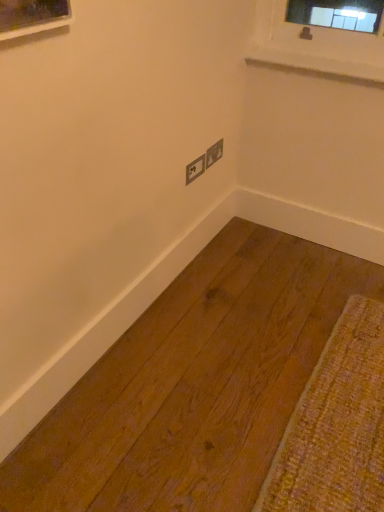
Question: From their relative heights in the image, would you say matte gray electrical outlet at center, the first electric outlet positioned from the right, is taller or shorter than white smooth window sill at upper right?

Choices:
 (A) short
 (B) tall

Answer: (B)

Question: Visually, is matte gray electrical outlet at center, acting as the second electric outlet starting from the left, positioned to the left or to the right of white smooth window sill at upper right?

Choices:
 (A) left
 (B) right

Answer: (A)

Question: Based on their relative distances, which object is nearer to the matte gray electric outlet at center, arranged as the second electric outlet when viewed from the right?

Choices:
 (A) white smooth window sill at upper right
 (B) matte gray electrical outlet at center, the first electric outlet positioned from the right

Answer: (B)

Question: Which object is the farthest from the matte gray electrical outlet at center, acting as the second electric outlet starting from the left?

Choices:
 (A) white smooth window sill at upper right
 (B) matte gray electric outlet at center, the 1th electric outlet from the left

Answer: (A)